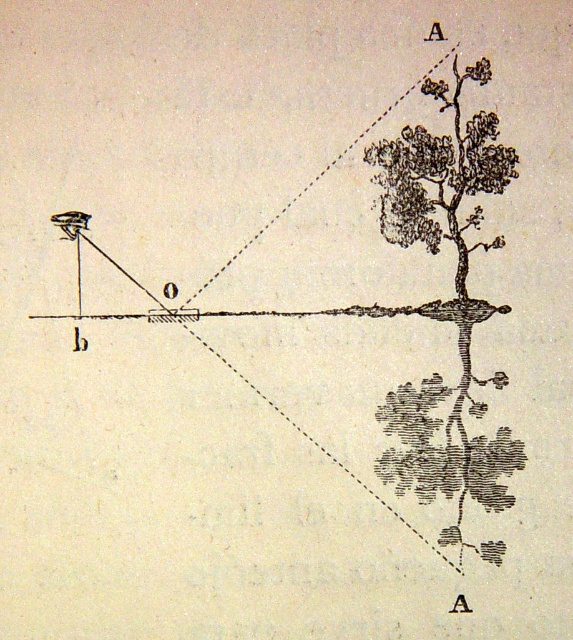
You are an architect designing a new park layout and need to place two black textured trees exactly as shown in the diagram. The park has strict spacing regulations requiring trees to be at least 5 meters apart. Based on the image, will the distance between the black textured tree at right and the black textured tree at upper right meet the regulation?

The black textured tree at right and black textured tree at upper right are 4.71 centimeters apart in the diagram. However, since the scale of the diagram isn not provided, we cannot convert this distance to real world measurements. Therefore, it is impossible to determine if the 4.71 cm distance meets the 5 meter regulation without additional information about the scale of the drawing.

You are an architect designing a new park layout. You need to place a black textured tree at right and a matte black rectangle at center such that they are visible from a central viewpoint. Given their widths, which object might require more space between it and the viewpoint to ensure full visibility?

The matte black rectangle at center requires more space because it has a greater width than the black textured tree at right, so to ensure full visibility from the central viewpoint, it needs to be placed farther away to accommodate its larger size.